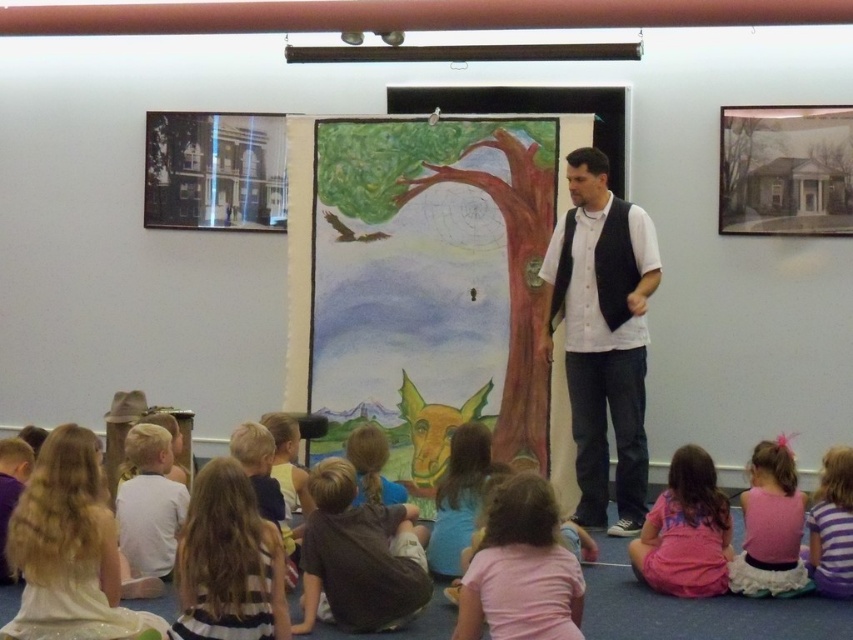
Is point (492, 616) in front of point (840, 545)?

Yes, point (492, 616) is closer to viewer.

Is pink fabric shirt at lower center shorter than striped cotton shirt at lower right?

Correct, pink fabric shirt at lower center is not as tall as striped cotton shirt at lower right.

Identify the location of pink fabric shirt at lower center. (521, 570).

This screenshot has height=640, width=853. Identify the location of pink fabric shirt at lower center. (521, 570).

Is white matte vest at center further to the viewer compared to striped cotton shirt at lower right?

Yes, it is.

Which of these two, white matte vest at center or striped cotton shirt at lower right, stands shorter?

striped cotton shirt at lower right is shorter.

Which is in front, point (579, 166) or point (834, 593)?

Point (834, 593)

Where is `white matte vest at center`? The image size is (853, 640). white matte vest at center is located at coordinates click(602, 336).

Is point (244, 540) closer to viewer compared to point (497, 502)?

Yes, point (244, 540) is closer to viewer.

Based on the photo, does striped fabric dress at lower left have a lesser width compared to pink fabric shirt at lower center?

No.

I want to click on striped fabric dress at lower left, so click(228, 563).